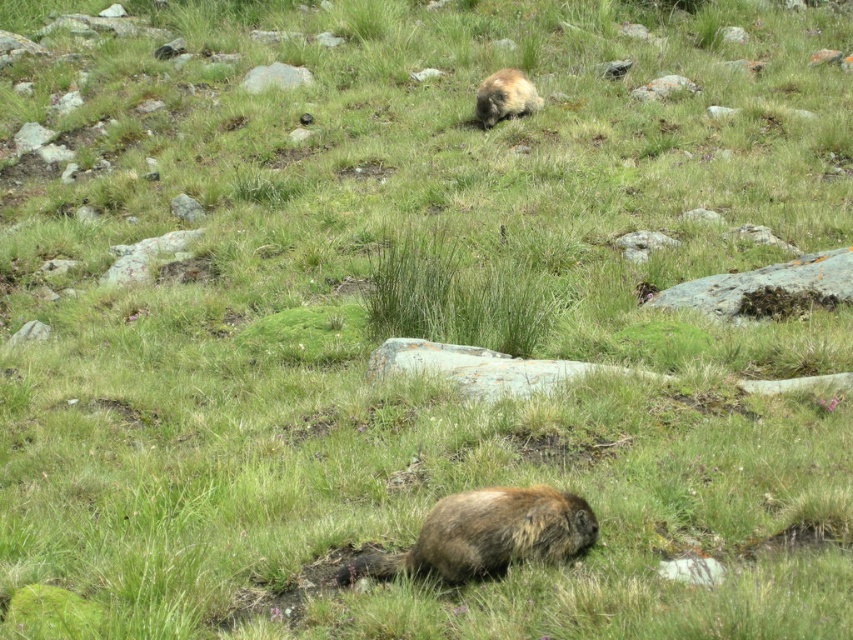
Does gray rough rock at right appear on the right side of gray rock at upper center?

Yes, gray rough rock at right is to the right of gray rock at upper center.

Which is more to the left, gray rough rock at right or gray rock at upper center?

gray rock at upper center

Who is more forward, [759,289] or [260,86]?

Point [759,289]

Identify the location of gray rough rock at right. Image resolution: width=853 pixels, height=640 pixels. [x=767, y=288].

Between brown furry groundhog at lower center and gray rock at upper center, which one appears on the left side from the viewer's perspective?

gray rock at upper center is more to the left.

Is brown furry groundhog at lower center further to camera compared to gray rock at upper center?

No, it is not.

Where is `brown furry groundhog at lower center`? brown furry groundhog at lower center is located at coordinates (486, 534).

Which is below, fuzzy brown animal at upper center or gray rock at upper center?

fuzzy brown animal at upper center is lower down.

Can you confirm if fuzzy brown animal at upper center is thinner than gray rock at upper center?

Yes.

Measure the distance between point (483,116) and camera.

A distance of 13.21 meters exists between point (483,116) and camera.

Where is `fuzzy brown animal at upper center`? Image resolution: width=853 pixels, height=640 pixels. fuzzy brown animal at upper center is located at coordinates 505,97.